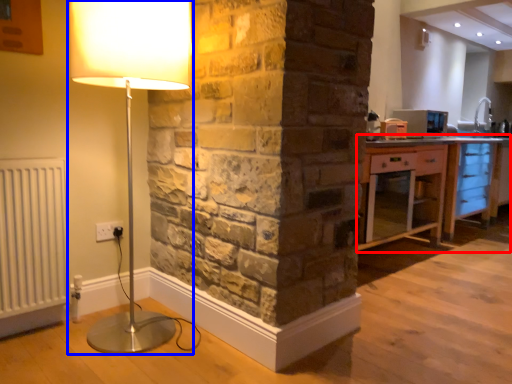
Question: Which point is closer to the camera, cabinetry (highlighted by a red box) or lamp (highlighted by a blue box)?

Choices:
 (A) cabinetry
 (B) lamp

Answer: (B)